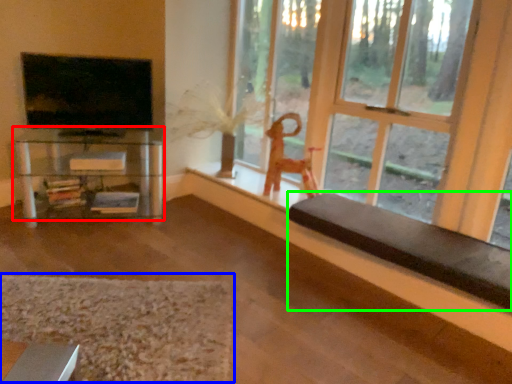
Question: Estimate the real-world distances between objects in this image. Which object is farther from shelf (highlighted by a red box), mat (highlighted by a blue box) or furniture (highlighted by a green box)?

Choices:
 (A) mat
 (B) furniture

Answer: (B)